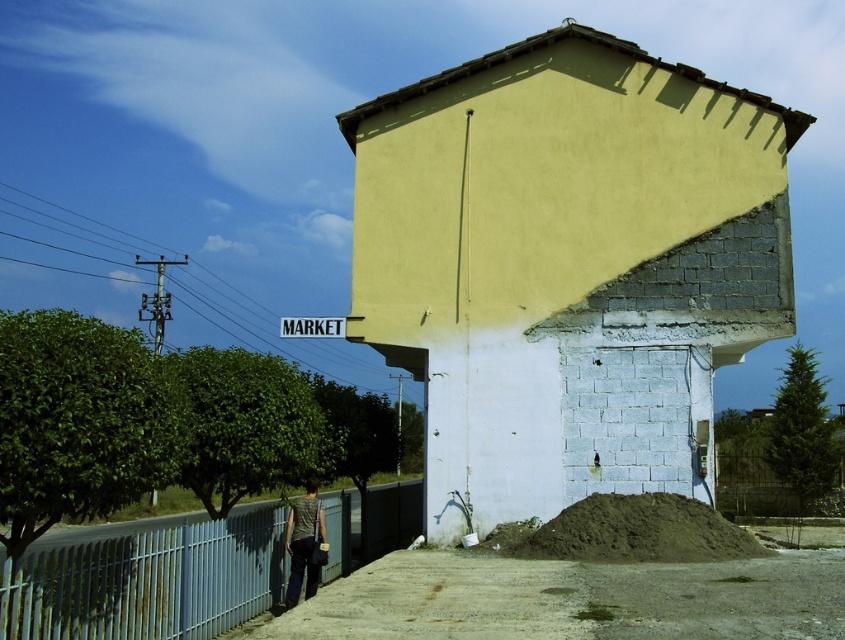
You are a delivery driver approaching the building with a vehicle that is 2 meters wide. The blue painted metal fence at lower left and the blue plastic sign at upper center are in your path. Can you pass through the space between them without hitting either?

The blue painted metal fence at lower left has a lesser width compared to the blue plastic sign at upper center. Since the fence is narrower, the space between them might be wide enough for the vehicle. However, without knowing the exact distance between the objects, it is uncertain if the 2 meter wide vehicle can pass safely.